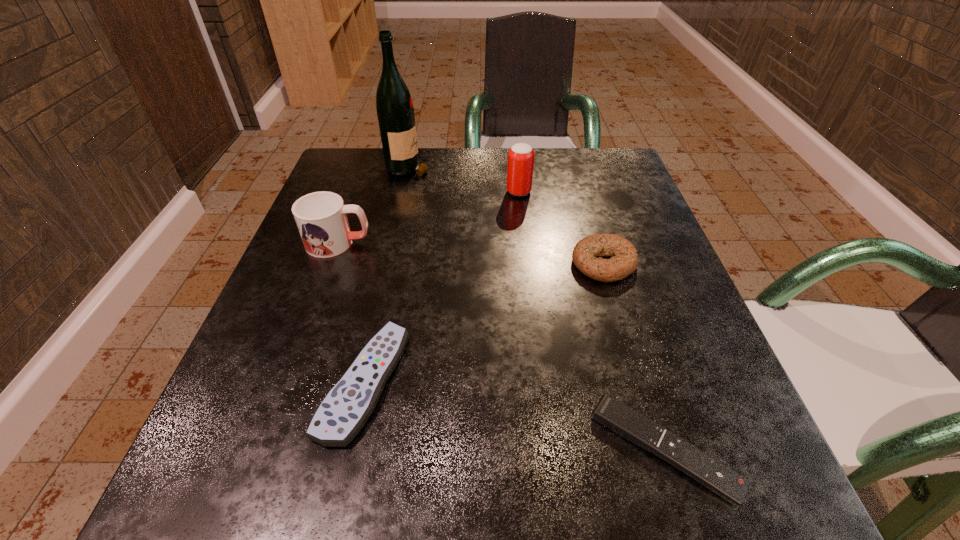
This screenshot has height=540, width=960. I want to click on free space located 0.270m on the right of the wine bottle, so click(x=543, y=166).

Find the location of a particular element. The height and width of the screenshot is (540, 960). vacant space located 0.100m on the front of the fifth nearest object is located at coordinates (523, 227).

This screenshot has height=540, width=960. Find the location of `free space located 0.080m on the side of the mug with the handle`. free space located 0.080m on the side of the mug with the handle is located at coordinates (413, 243).

The height and width of the screenshot is (540, 960). I want to click on free location located on the left of the bagel, so click(x=544, y=264).

In order to click on vacant area located on the left of the fifth tallest object in this screenshot , I will do `click(276, 382)`.

You are a GUI agent. You are given a task and a screenshot of the screen. Output one action in this format:
    pyautogui.click(x=<x>, y=<y>)
    Task: Click on the vacant space located on the back of the shorter remote control
    This screenshot has height=540, width=960.
    Given the screenshot: What is the action you would take?
    pyautogui.click(x=597, y=233)

This screenshot has height=540, width=960. Find the location of `wine bottle that is at the far edge`. wine bottle that is at the far edge is located at coordinates (395, 111).

The image size is (960, 540). In order to click on beer can that is at the far edge in this screenshot , I will do `click(520, 166)`.

You are a GUI agent. You are given a task and a screenshot of the screen. Output one action in this format:
    pyautogui.click(x=<x>, y=<y>)
    Task: Click on the object positioned at the near edge
    This screenshot has height=540, width=960.
    Given the screenshot: What is the action you would take?
    pyautogui.click(x=630, y=424)

Locate an element on the screen. This screenshot has width=960, height=540. wine bottle that is at the left edge is located at coordinates (395, 111).